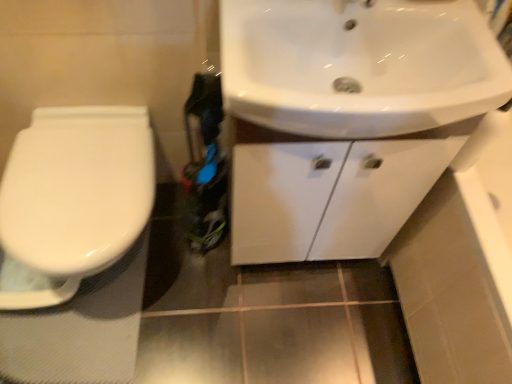
Question: Can you confirm if white glossy toilet at left is taller than white glossy sink at upper right?

Choices:
 (A) no
 (B) yes

Answer: (B)

Question: Is white glossy toilet at left oriented away from white glossy sink at upper right?

Choices:
 (A) no
 (B) yes

Answer: (A)

Question: Is the surface of white glossy toilet at left in direct contact with white glossy sink at upper right?

Choices:
 (A) no
 (B) yes

Answer: (A)

Question: Can you confirm if white glossy toilet at left is bigger than white glossy sink at upper right?

Choices:
 (A) no
 (B) yes

Answer: (B)

Question: Can you confirm if white glossy toilet at left is smaller than white glossy sink at upper right?

Choices:
 (A) yes
 (B) no

Answer: (B)

Question: Is white glossy sink at upper right bigger or smaller than white glossy toilet at left?

Choices:
 (A) big
 (B) small

Answer: (B)

Question: From the image's perspective, relative to white glossy toilet at left, is white glossy sink at upper right above or below?

Choices:
 (A) above
 (B) below

Answer: (A)

Question: Is point (389, 21) closer or farther from the camera than point (125, 157)?

Choices:
 (A) farther
 (B) closer

Answer: (B)

Question: Which is correct: white glossy sink at upper right is inside white glossy toilet at left, or outside of it?

Choices:
 (A) outside
 (B) inside

Answer: (A)

Question: Based on their positions, is white glossy toilet at left located to the left or right of white glossy sink at upper right?

Choices:
 (A) right
 (B) left

Answer: (B)

Question: In terms of size, does white glossy toilet at left appear bigger or smaller than white glossy sink at upper right?

Choices:
 (A) small
 (B) big

Answer: (B)

Question: From the image's perspective, is white glossy toilet at left located above or below white glossy sink at upper right?

Choices:
 (A) below
 (B) above

Answer: (A)

Question: From a real-world perspective, relative to white glossy sink at upper right, is white glossy toilet at left vertically above or below?

Choices:
 (A) below
 (B) above

Answer: (A)

Question: Considering the positions of white glossy cabinet at upper right and white glossy sink at upper right in the image, is white glossy cabinet at upper right wider or thinner than white glossy sink at upper right?

Choices:
 (A) thin
 (B) wide

Answer: (A)

Question: Relative to white glossy sink at upper right, is white glossy cabinet at upper right in front or behind?

Choices:
 (A) front
 (B) behind

Answer: (B)